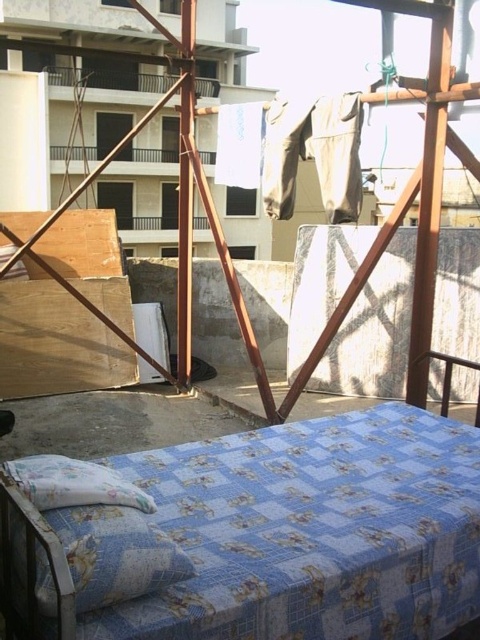
Can you confirm if blue printed fabric bed at center is smaller than fluffy white pillow at lower left?

No.

Is blue printed fabric bed at center thinner than fluffy white pillow at lower left?

Incorrect, blue printed fabric bed at center's width is not less than fluffy white pillow at lower left's.

Between point (222, 634) and point (45, 490), which one is positioned behind?

The point (45, 490) is behind.

Where is `blue printed fabric bed at center`? blue printed fabric bed at center is located at coordinates (32, 576).